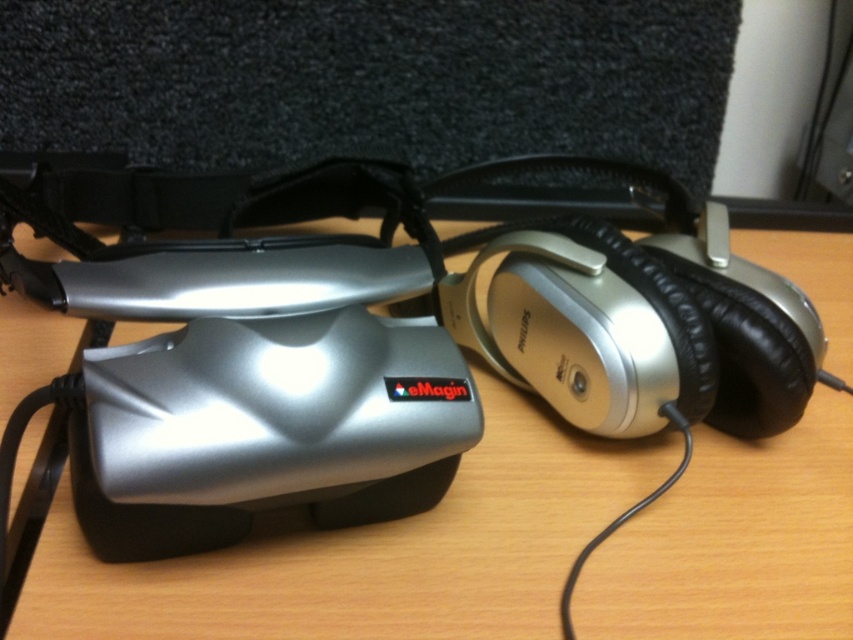
How distant is wooden table at center from silver metallic mouse at center-right?

A distance of 6.07 inches exists between wooden table at center and silver metallic mouse at center-right.

Is wooden table at center taller than silver metallic mouse at center-right?

Correct, wooden table at center is much taller as silver metallic mouse at center-right.

Find the location of `wooden table at center`. wooden table at center is located at coordinates (375, 552).

The height and width of the screenshot is (640, 853). What are the coordinates of `wooden table at center` in the screenshot? It's located at (375, 552).